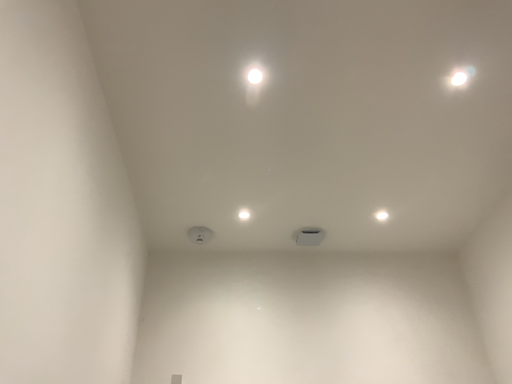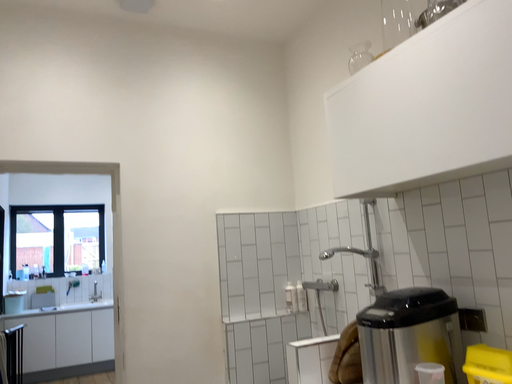
Question: Which way did the camera rotate in the video?

Choices:
 (A) rotated right
 (B) rotated left

Answer: (A)